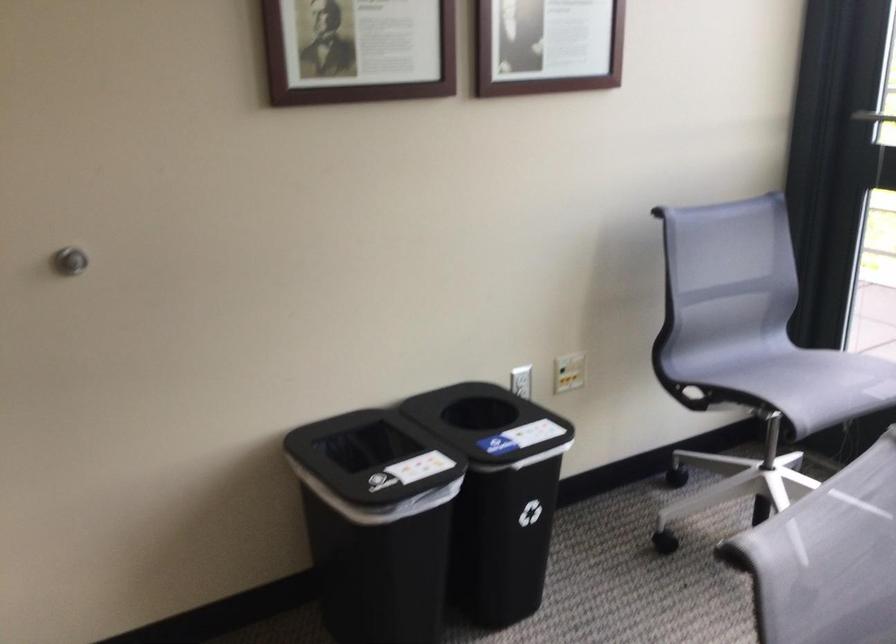
The width and height of the screenshot is (896, 644). What are the coordinates of `chair adjustment lever` in the screenshot? It's located at (668, 382).